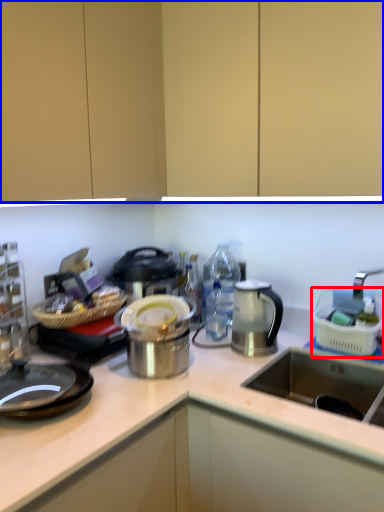
Question: Which of the following is the farthest to the observer, appliance (highlighted by a red box) or cabinetry (highlighted by a blue box)?

Choices:
 (A) appliance
 (B) cabinetry

Answer: (A)